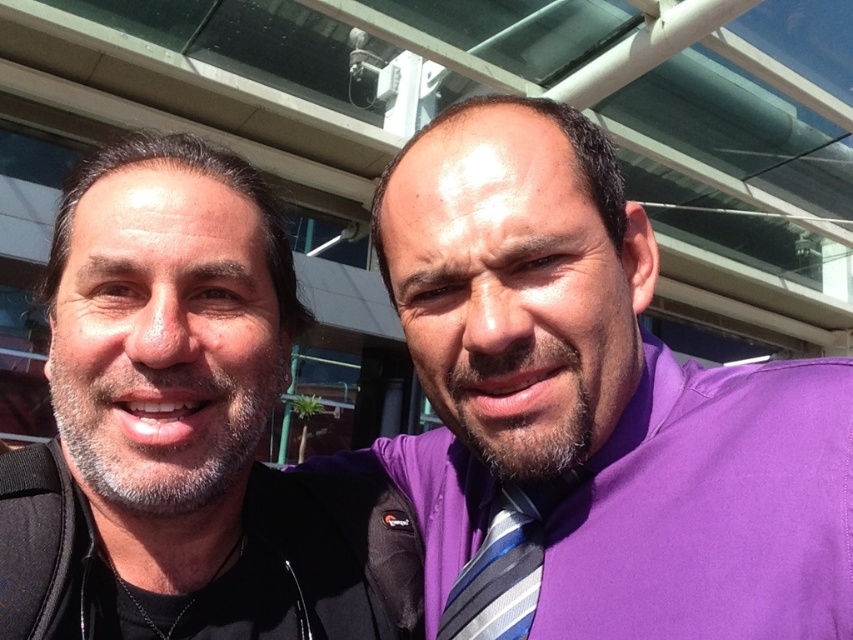
Which is above, black softshell jacket at left or striped fabric tie at center?

black softshell jacket at left is higher up.

Looking at this image, who is positioned more to the right, black softshell jacket at left or striped fabric tie at center?

Positioned to the right is striped fabric tie at center.

Where is `black softshell jacket at left`? The width and height of the screenshot is (853, 640). black softshell jacket at left is located at coordinates 338,552.

Based on the photo, is black matte jacket at left below black softshell jacket at left?

Incorrect, black matte jacket at left is not positioned below black softshell jacket at left.

Is black matte jacket at left further to the viewer compared to black softshell jacket at left?

That is False.

Who is more forward, [233,524] or [418,611]?

Positioned in front is point [233,524].

Find the location of a particular element. Image resolution: width=853 pixels, height=640 pixels. black matte jacket at left is located at coordinates (184, 429).

Between purple fabric shirt at right and striped fabric tie at center, which one has more height?

Standing taller between the two is purple fabric shirt at right.

Which is more to the left, purple fabric shirt at right or striped fabric tie at center?

purple fabric shirt at right is more to the left.

Does point (461, 385) lie behind point (520, 492)?

No, it is in front of (520, 492).

Where is `purple fabric shirt at right`? purple fabric shirt at right is located at coordinates point(590,410).